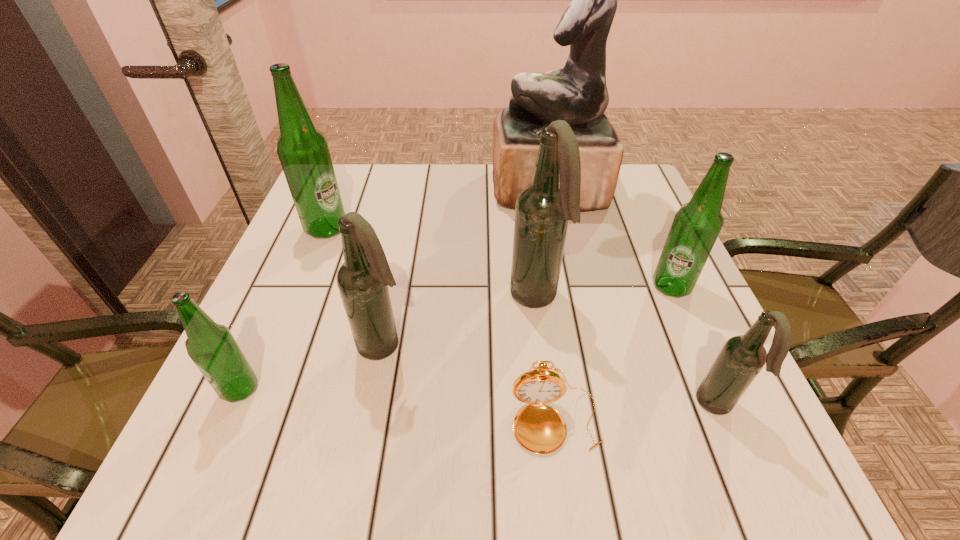
Image resolution: width=960 pixels, height=540 pixels. In order to click on free space located on the back of the smallest dark beer bottle in this screenshot , I will do `click(648, 246)`.

Locate an element on the screen. free space located on the label of the nearest green beer bottle is located at coordinates 208,460.

You are a GUI agent. You are given a task and a screenshot of the screen. Output one action in this format:
    pyautogui.click(x=<x>, y=<y>)
    Task: Click on the object located in the far edge section of the desktop
    This screenshot has height=540, width=960.
    Given the screenshot: What is the action you would take?
    pyautogui.click(x=577, y=94)

You are a GUI agent. You are given a task and a screenshot of the screen. Output one action in this format:
    pyautogui.click(x=<x>, y=<y>)
    Task: Click on the object at the near edge
    
    Given the screenshot: What is the action you would take?
    pyautogui.click(x=539, y=428)

Identify the location of sculpture located at the right edge. This screenshot has height=540, width=960. (577, 94).

This screenshot has width=960, height=540. What are the coordinates of `object situated at the far right corner` in the screenshot? It's located at (577, 94).

This screenshot has height=540, width=960. In order to click on blank space at the far edge of the desktop in this screenshot , I will do `click(487, 174)`.

Find the location of a particular element. vacant space at the near edge is located at coordinates (637, 440).

The height and width of the screenshot is (540, 960). In the image, there is a desktop. In order to click on free space at the left edge in this screenshot , I will do `click(314, 255)`.

In the image, there is a desktop. Where is `free space at the right edge`? free space at the right edge is located at coordinates (622, 280).